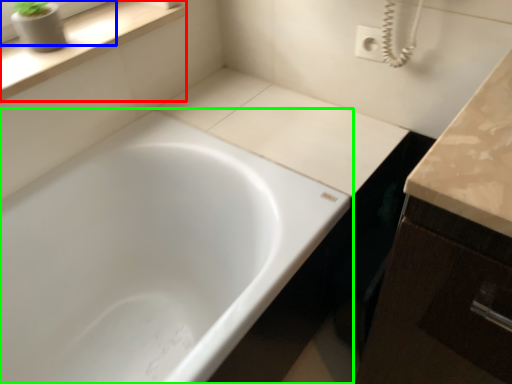
Question: Which object is positioned closest to window sill (highlighted by a red box)? Select from window frame (highlighted by a blue box) and bathtub (highlighted by a green box).

Choices:
 (A) window frame
 (B) bathtub

Answer: (A)